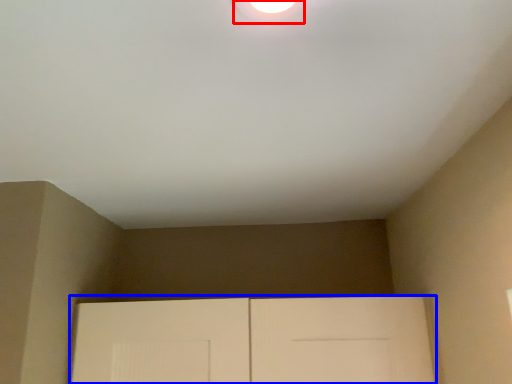
Question: Which object is further to the camera taking this photo, droplight (highlighted by a red box) or door (highlighted by a blue box)?

Choices:
 (A) droplight
 (B) door

Answer: (B)